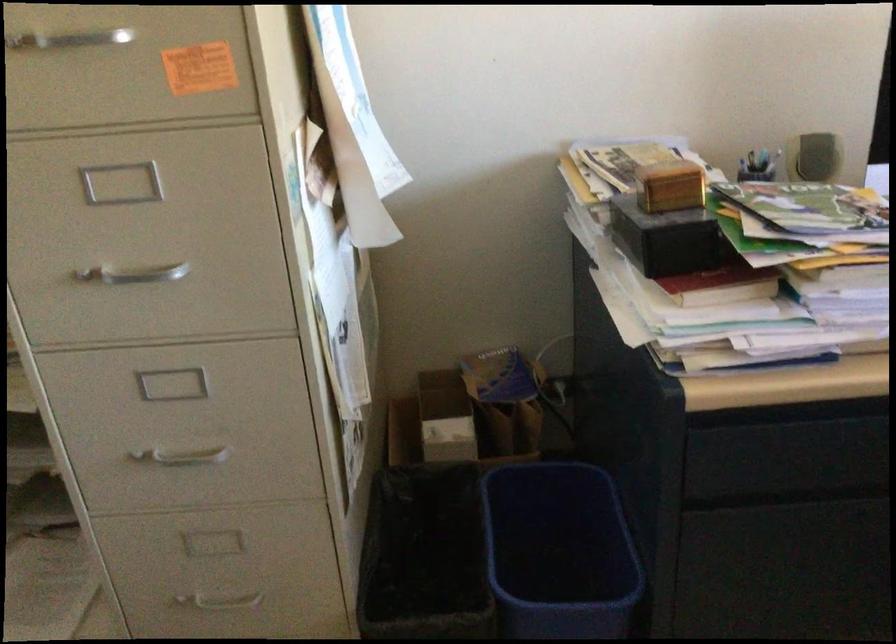
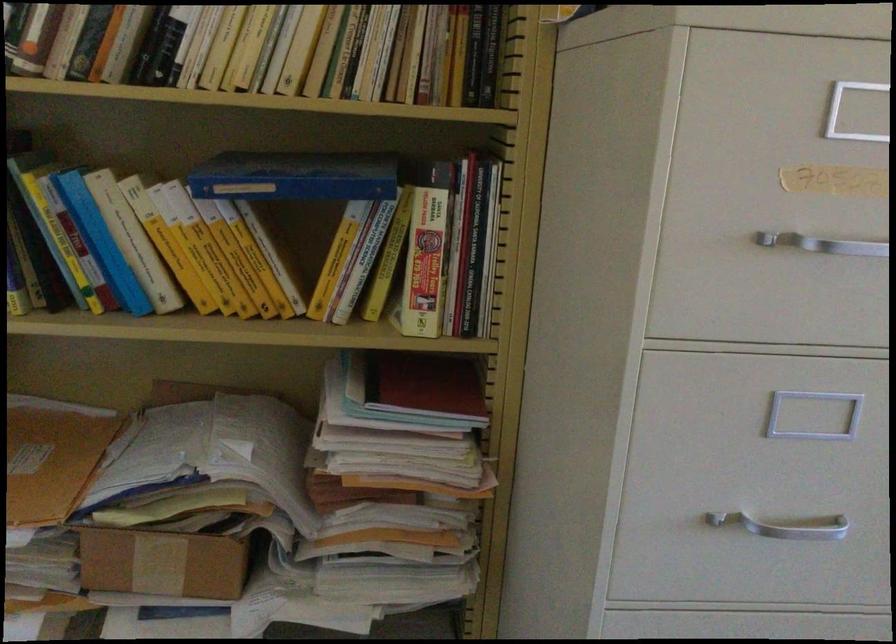
Question: I am providing you with two images of the same scene from different viewpoints. Which of the following objects are not visible in image2?

Choices:
 (A) small cardboard box
 (B) blue book box
 (C) metal drawer handle
 (D) none of these

Answer: (D)